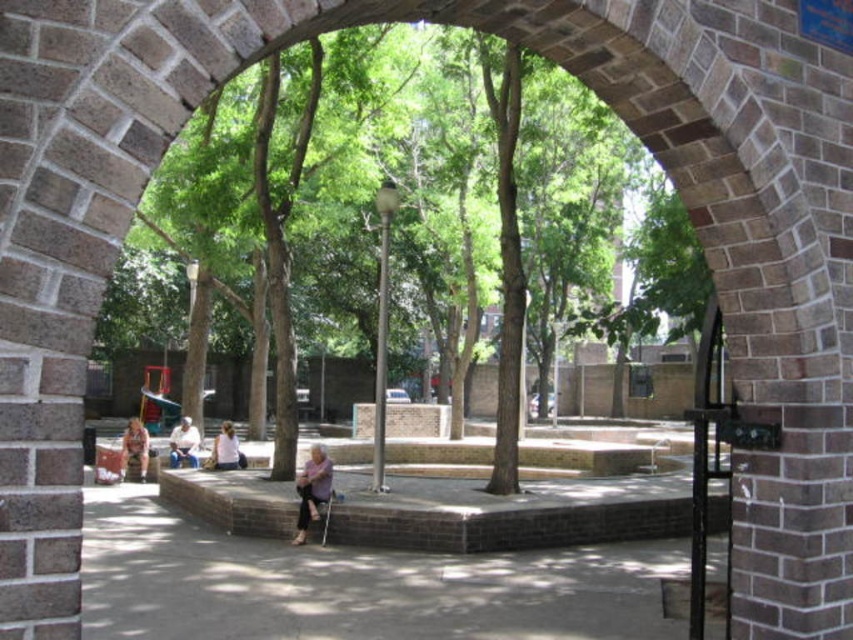
Is brown leather jacket at lower left positioned before light purple fabric shirt at center?

No, it is not.

Does brown leather jacket at lower left appear under light purple fabric shirt at center?

Actually, brown leather jacket at lower left is above light purple fabric shirt at center.

Which is behind, point (142, 476) or point (213, 438)?

The point (213, 438) is behind.

Locate an element on the screen. Image resolution: width=853 pixels, height=640 pixels. brown leather jacket at lower left is located at coordinates pyautogui.click(x=135, y=448).

Can you confirm if purple fabric at center is wider than brown leather jacket at lower left?

No, purple fabric at center is not wider than brown leather jacket at lower left.

Who is higher up, purple fabric at center or brown leather jacket at lower left?

purple fabric at center is higher up.

Which is behind, point (329, 492) or point (120, 467)?

The point (120, 467) is more distant.

I want to click on purple fabric at center, so [x=312, y=490].

Does point (187, 451) come farther from viewer compared to point (230, 440)?

Yes, it is behind point (230, 440).

Between light brown leather jacket at center and light purple fabric shirt at center, which one is positioned lower?

light purple fabric shirt at center is lower down.

What are the coordinates of `light brown leather jacket at center` in the screenshot? It's located at (184, 444).